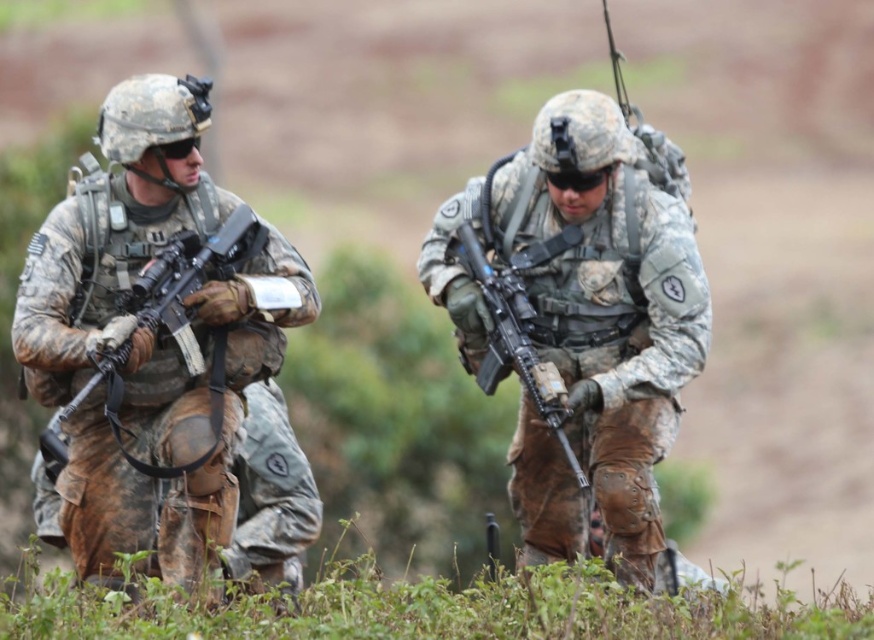
Who is positioned more to the right, camouflage uniform at left or camouflage uniform at center?

camouflage uniform at center is more to the right.

Consider the image. Between camouflage uniform at left and camouflage uniform at center, which one has less height?

Standing shorter between the two is camouflage uniform at left.

Does point (109, 209) lie behind point (651, 374)?

Yes, it is behind point (651, 374).

At what (x,y) coordinates should I click in order to perform the action: click on camouflage uniform at left. Please return your answer as a coordinate pair (x, y). This screenshot has width=874, height=640. Looking at the image, I should click on (151, 339).

Does camouflage uniform at center appear on the right side of matte black rifle at center?

Yes, camouflage uniform at center is to the right of matte black rifle at center.

Does camouflage uniform at center have a lesser width compared to matte black rifle at center?

Incorrect, camouflage uniform at center's width is not less than matte black rifle at center's.

The image size is (874, 640). What are the coordinates of `camouflage uniform at center` in the screenshot? It's located at (611, 312).

Locate an element on the screen. camouflage uniform at center is located at coordinates (611, 312).

Between camouflage uniform at left and matte black rifle at left, which one appears on the left side from the viewer's perspective?

camouflage uniform at left is more to the left.

Who is higher up, camouflage uniform at left or matte black rifle at left?

matte black rifle at left

What are the coordinates of `camouflage uniform at left` in the screenshot? It's located at (151, 339).

Locate an element on the screen. The width and height of the screenshot is (874, 640). camouflage uniform at left is located at coordinates (151, 339).